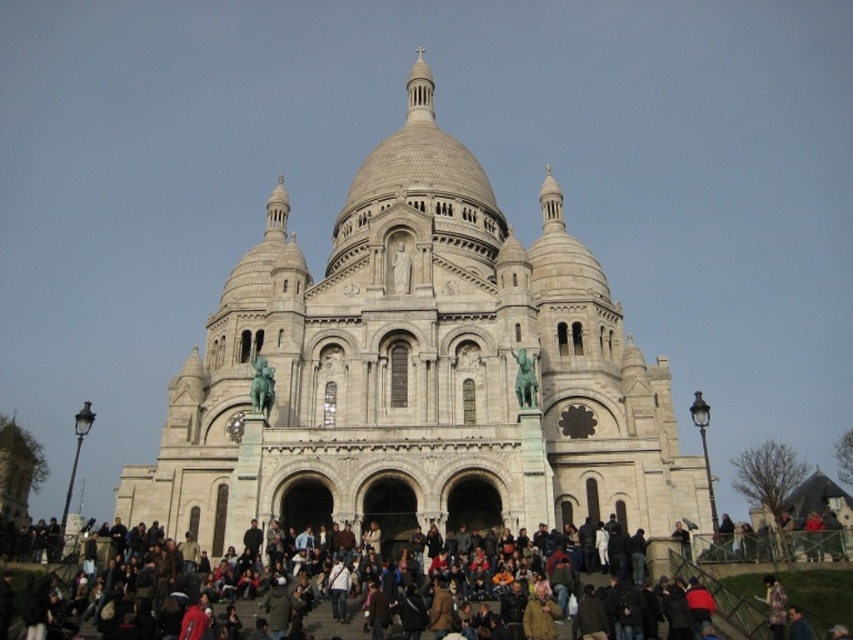
The height and width of the screenshot is (640, 853). Describe the element at coordinates (416, 371) in the screenshot. I see `white stone church at center` at that location.

Which is above, white stone church at center or multicolored clothing at lower center?

white stone church at center is higher up.

This screenshot has height=640, width=853. I want to click on white stone church at center, so click(416, 371).